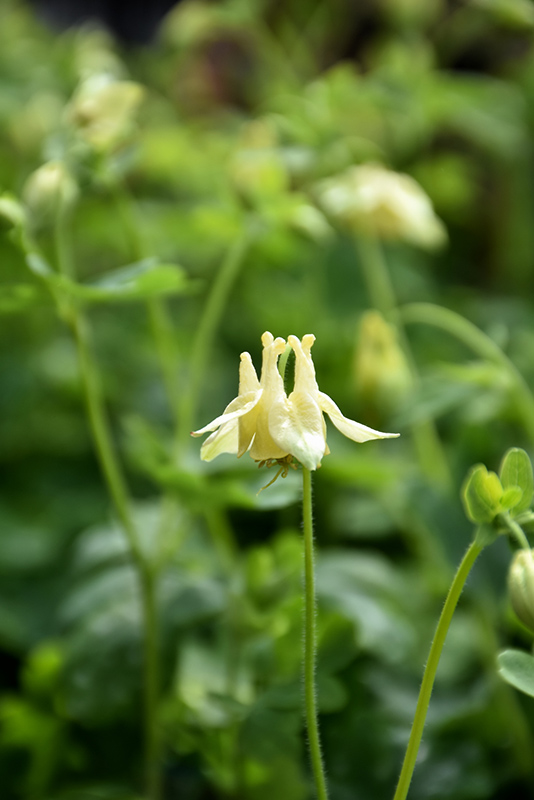
Image resolution: width=534 pixels, height=800 pixels. In order to click on plant in this screenshot , I will do `click(295, 408)`.